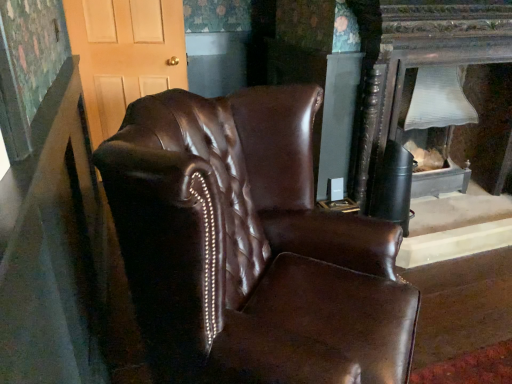
Question: Is shiny brown leather armchair at center wider than matte wood door at upper left?

Choices:
 (A) yes
 (B) no

Answer: (A)

Question: Is shiny brown leather armchair at center aimed at matte wood door at upper left?

Choices:
 (A) no
 (B) yes

Answer: (A)

Question: Considering the relative positions of shiny brown leather armchair at center and matte wood door at upper left in the image provided, is shiny brown leather armchair at center to the left of matte wood door at upper left from the viewer's perspective?

Choices:
 (A) no
 (B) yes

Answer: (A)

Question: Considering the relative sizes of shiny brown leather armchair at center and matte wood door at upper left in the image provided, is shiny brown leather armchair at center taller than matte wood door at upper left?

Choices:
 (A) yes
 (B) no

Answer: (A)

Question: Does shiny brown leather armchair at center come behind matte wood door at upper left?

Choices:
 (A) yes
 (B) no

Answer: (B)

Question: Is point (398, 140) closer or farther from the camera than point (204, 158)?

Choices:
 (A) closer
 (B) farther

Answer: (B)

Question: Looking at their shapes, would you say matte white lampshade at right is wider or thinner than shiny brown leather armchair at center?

Choices:
 (A) wide
 (B) thin

Answer: (B)

Question: Is matte white lampshade at right inside the boundaries of shiny brown leather armchair at center, or outside?

Choices:
 (A) outside
 (B) inside

Answer: (A)

Question: From the image's perspective, is matte white lampshade at right above or below shiny brown leather armchair at center?

Choices:
 (A) above
 (B) below

Answer: (A)

Question: Is matte white lampshade at right taller or shorter than matte wood door at upper left?

Choices:
 (A) tall
 (B) short

Answer: (B)

Question: Is matte white lampshade at right spatially inside matte wood door at upper left, or outside of it?

Choices:
 (A) inside
 (B) outside

Answer: (B)

Question: Considering the positions of point (458, 192) and point (115, 117), is point (458, 192) closer or farther from the camera than point (115, 117)?

Choices:
 (A) farther
 (B) closer

Answer: (B)

Question: Would you say matte white lampshade at right is to the left or to the right of matte wood door at upper left in the picture?

Choices:
 (A) right
 (B) left

Answer: (A)

Question: From the image's perspective, is shiny brown leather armchair at center above or below matte wood door at upper left?

Choices:
 (A) above
 (B) below

Answer: (B)

Question: In terms of width, does shiny brown leather armchair at center look wider or thinner when compared to matte wood door at upper left?

Choices:
 (A) thin
 (B) wide

Answer: (B)